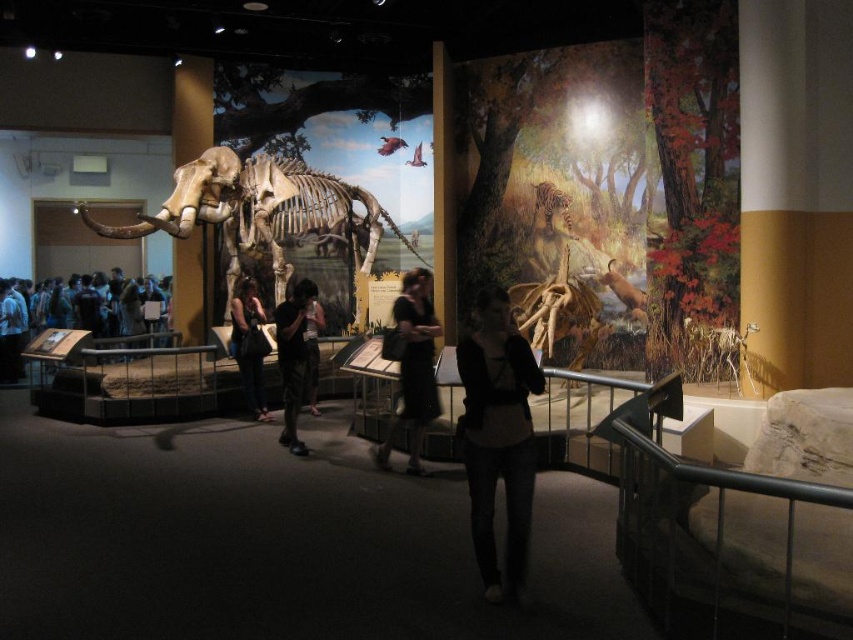
Is point (247, 218) closer to camera compared to point (467, 408)?

No.

Between matte bone-like skeleton at center and denim jeans at center, which one is positioned lower?

denim jeans at center is lower down.

Find the location of a particular element. The height and width of the screenshot is (640, 853). matte bone-like skeleton at center is located at coordinates (260, 211).

Who is higher up, denim jeans at center or matte black shirt at center?

matte black shirt at center is higher up.

Is denim jeans at center smaller than matte black shirt at center?

Actually, denim jeans at center might be larger than matte black shirt at center.

Which is behind, point (514, 374) or point (267, 342)?

The point (267, 342) is more distant.

At what (x,y) coordinates should I click in order to perform the action: click on denim jeans at center. Please return your answer as a coordinate pair (x, y). This screenshot has width=853, height=640. Looking at the image, I should click on (498, 436).

Does denim jeans at center have a lesser height compared to black fabric dress at center?

Indeed, denim jeans at center has a lesser height compared to black fabric dress at center.

Does denim jeans at center appear on the right side of black fabric dress at center?

Indeed, denim jeans at center is positioned on the right side of black fabric dress at center.

Locate an element on the screen. This screenshot has height=640, width=853. denim jeans at center is located at coordinates (498, 436).